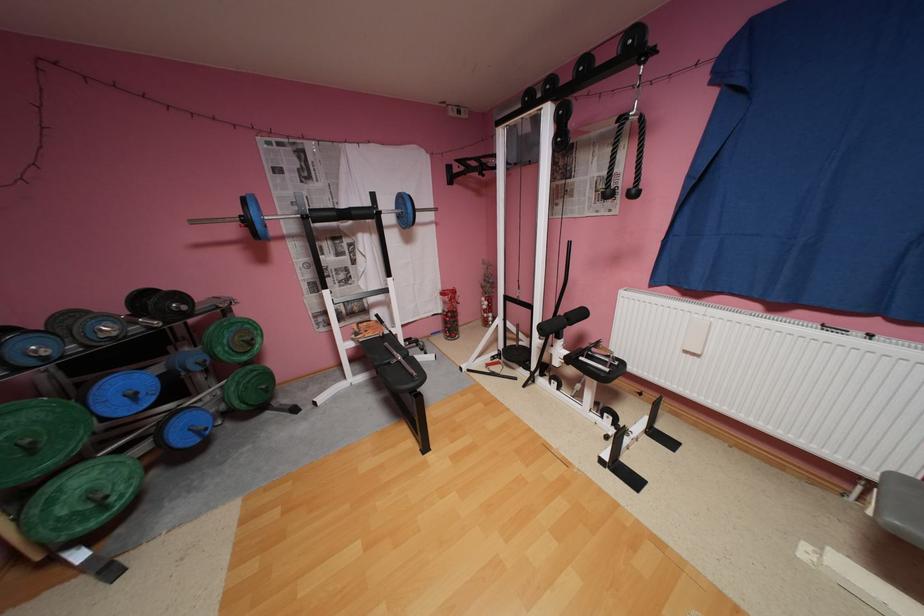
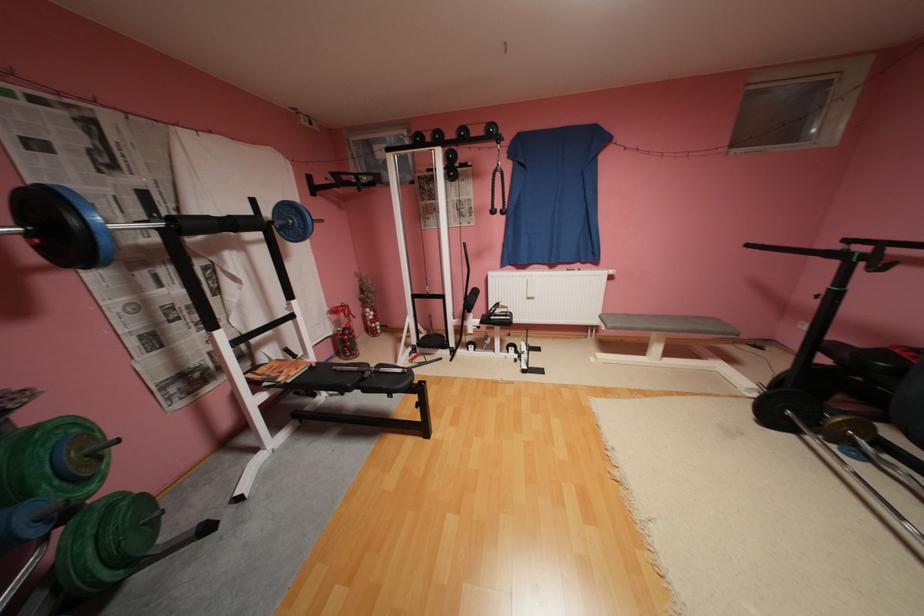
Question: I am providing you with two images of the same scene from different viewpoints. Please identify which objects are invisible in image2.

Choices:
 (A) silver barbell
 (B) black bench surface
 (C) gold weight plate
 (D) none of these

Answer: (D)